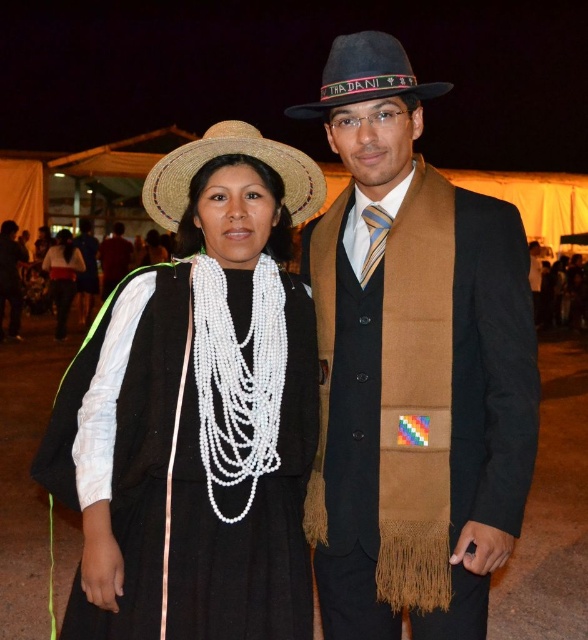
Question: Does brown woolen scarf at center have a larger size compared to strawhat at left?

Choices:
 (A) yes
 (B) no

Answer: (B)

Question: Does white beaded necklace at center have a greater width compared to black woolen vest at center?

Choices:
 (A) no
 (B) yes

Answer: (B)

Question: Which is farther from the strawhat at left?

Choices:
 (A) white beaded necklace at center
 (B) brown woolen scarf at center
 (C) black woven hat at upper left
 (D) black felt cowboy hat at upper center

Answer: (A)

Question: Is white pearl necklace at center to the right of black woolen vest at center from the viewer's perspective?

Choices:
 (A) yes
 (B) no

Answer: (A)

Question: Which of the following is the farthest from the observer?

Choices:
 (A) strawhat at left
 (B) brown woolen scarf at center

Answer: (A)

Question: Which of the following is the closest to the observer?

Choices:
 (A) (258, 369)
 (B) (252, 557)
 (C) (473, 452)

Answer: (B)